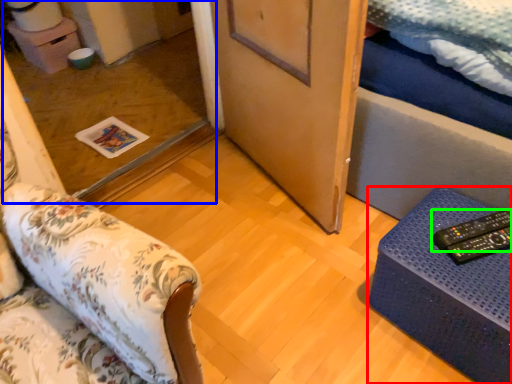
Question: Based on their relative distances, which object is nearer to furniture (highlighted by a red box)? Choose from glass door (highlighted by a blue box) and remote (highlighted by a green box).

Choices:
 (A) glass door
 (B) remote

Answer: (B)